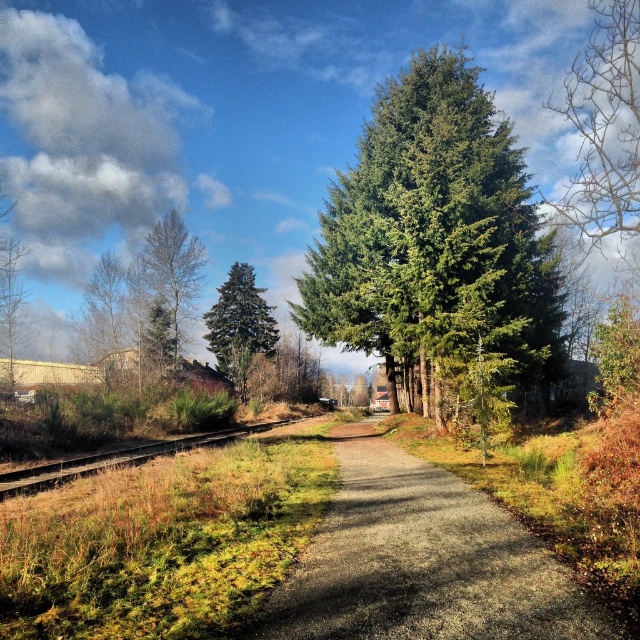
Question: Can you confirm if bare branches at upper right is bigger than green matte tree at center?

Choices:
 (A) yes
 (B) no

Answer: (A)

Question: Can you confirm if bare branches at upper right is positioned below green matte tree at center?

Choices:
 (A) no
 (B) yes

Answer: (A)

Question: Which object is closer to the camera taking this photo?

Choices:
 (A) brown wood tree at left
 (B) brown wooden train track at left

Answer: (B)

Question: Among these points, which one is farthest from the camera?

Choices:
 (A) (474, 513)
 (B) (595, 211)
 (C) (84, 294)

Answer: (C)

Question: Which object is positioned farthest from the green needle-like tree at center?

Choices:
 (A) bare wood tree at left
 (B) brown wood tree at left
 (C) gravel path at center
 (D) brown wooden train track at left

Answer: (B)

Question: From the image, what is the correct spatial relationship of green needle-like tree at center in relation to green matte tree at center?

Choices:
 (A) below
 (B) above

Answer: (B)